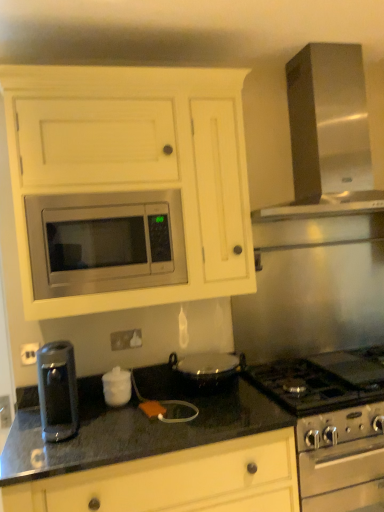
Question: Is stainless steel microwave at center bigger or smaller than black granite countertop at lower center?

Choices:
 (A) big
 (B) small

Answer: (B)

Question: Is point (172, 253) closer or farther from the camera than point (283, 506)?

Choices:
 (A) farther
 (B) closer

Answer: (A)

Question: Estimate the real-world distances between objects in this image. Which object is closer to the stainless steel microwave at center?

Choices:
 (A) black granite countertop at lower center
 (B) satin silver exhaust hood at upper right
 (C) white glossy sugar bowl at center, acting as the first appliance starting from the top
 (D) matte white cabinet at upper center
 (E) white glossy electric outlet at center

Answer: (D)

Question: Which object is positioned farthest from the white glossy sugar bowl at center, acting as the first appliance starting from the top?

Choices:
 (A) satin silver stove at lower right, the second appliance when ordered from left to right
 (B) satin metallic coffee maker at lower left
 (C) stainless steel microwave at center
 (D) white glossy electric outlet at center
 (E) black granite countertop at lower center

Answer: (A)